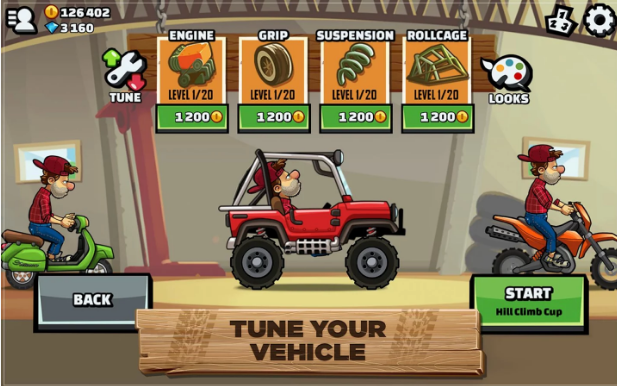
The width and height of the screenshot is (617, 386). In order to click on window in this screenshot , I will do `click(27, 166)`, `click(67, 154)`, `click(568, 156)`.